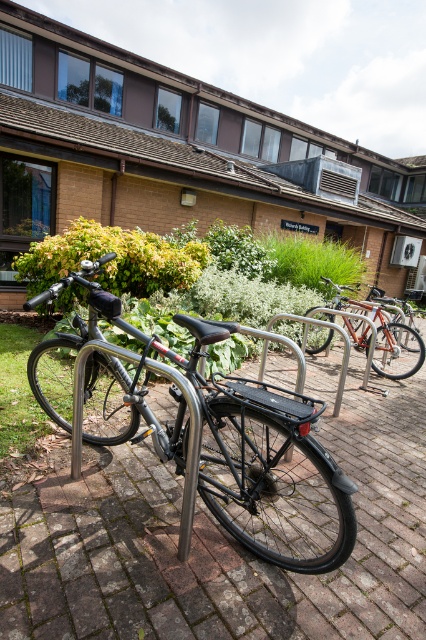
Can you confirm if shiny black bicycle at center is positioned below orange metallic bicycle at center?

Indeed, shiny black bicycle at center is positioned under orange metallic bicycle at center.

Which is above, shiny black bicycle at center or orange metallic bicycle at center?

orange metallic bicycle at center

Which is behind, point (98, 268) or point (311, 310)?

Point (311, 310)

Locate an element on the screen. The width and height of the screenshot is (426, 640). shiny black bicycle at center is located at coordinates click(x=210, y=433).